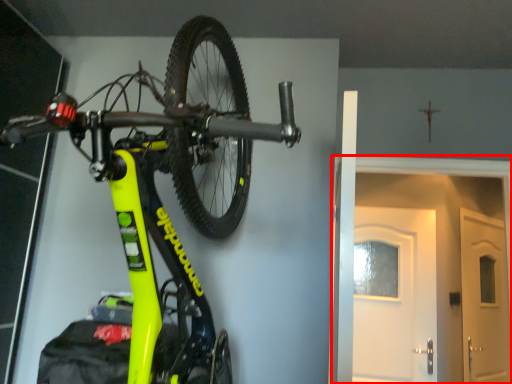
Question: From the image's perspective, what is the correct spatial relationship of door (annotated by the red box) in relation to bicycle?

Choices:
 (A) below
 (B) above

Answer: (A)